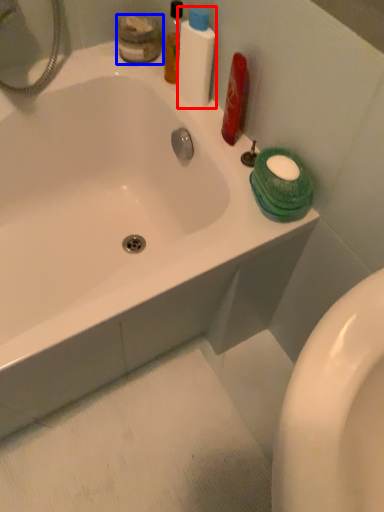
Question: Which object appears farthest to the camera in this image, cleaning product (highlighted by a red box) or toiletry (highlighted by a blue box)?

Choices:
 (A) cleaning product
 (B) toiletry

Answer: (B)